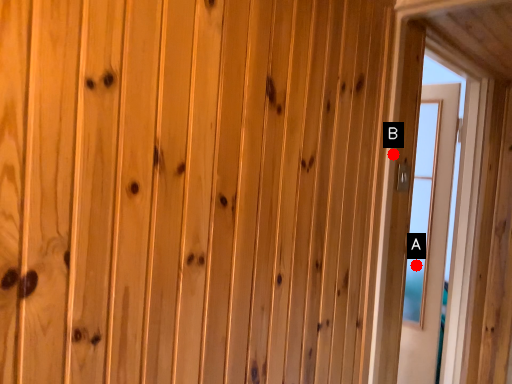
Question: Two points are circled on the image, labeled by A and B beside each circle. Among these points, which one is nearest to the camera?

Choices:
 (A) A is closer
 (B) B is closer

Answer: (B)